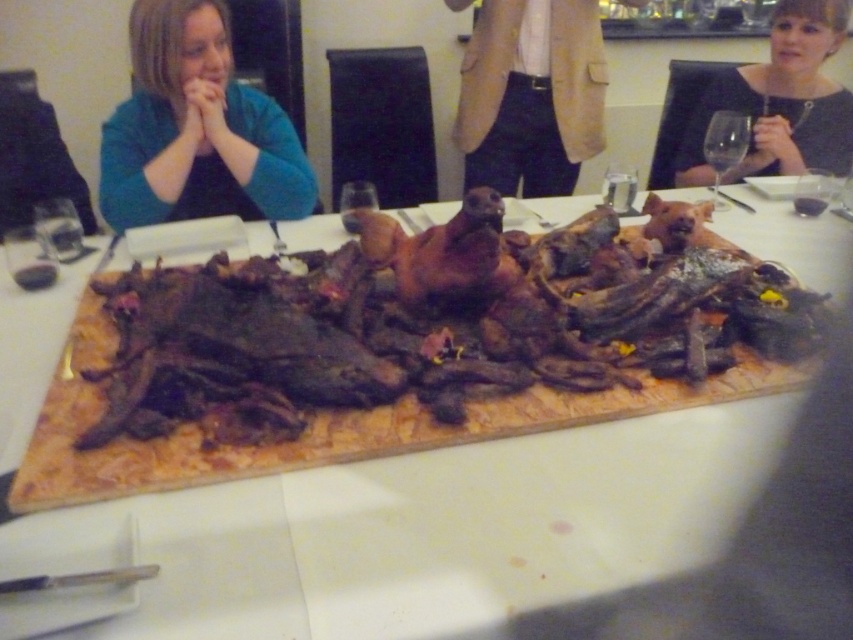
Can you confirm if transparent glass at upper right is wider than brown wooden board at center?

No, transparent glass at upper right is not wider than brown wooden board at center.

You are a GUI agent. You are given a task and a screenshot of the screen. Output one action in this format:
    pyautogui.click(x=<x>, y=<y>)
    Task: Click on the transparent glass at upper right
    This screenshot has width=853, height=640.
    Given the screenshot: What is the action you would take?
    pos(724,144)

Where is `transparent glass at upper right`? The height and width of the screenshot is (640, 853). transparent glass at upper right is located at coordinates (724, 144).

Who is more forward, (198, 81) or (361, 512)?

Point (361, 512) is more forward.

Is teal fabric at left positioned before brown wooden board at center?

No, teal fabric at left is further to the viewer.

Does point (181, 42) come behind point (563, 525)?

That is True.

This screenshot has height=640, width=853. What are the coordinates of `teal fabric at left` in the screenshot? It's located at (196, 129).

Is teal fabric at left to the right of dark gray dress at upper right from the viewer's perspective?

Incorrect, teal fabric at left is not on the right side of dark gray dress at upper right.

Between teal fabric at left and dark gray dress at upper right, which one has less height?

teal fabric at left

Image resolution: width=853 pixels, height=640 pixels. I want to click on teal fabric at left, so click(196, 129).